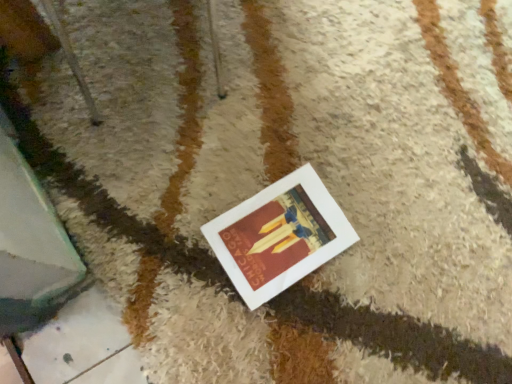
Identify the location of vacant space situated above white matte picture frame at center (from a real-world perspective). Image resolution: width=512 pixels, height=384 pixels. (283, 232).